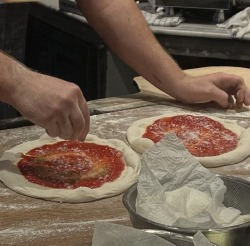
Where is `metal bowl`? The image size is (250, 246). metal bowl is located at coordinates (183, 238), (238, 192).